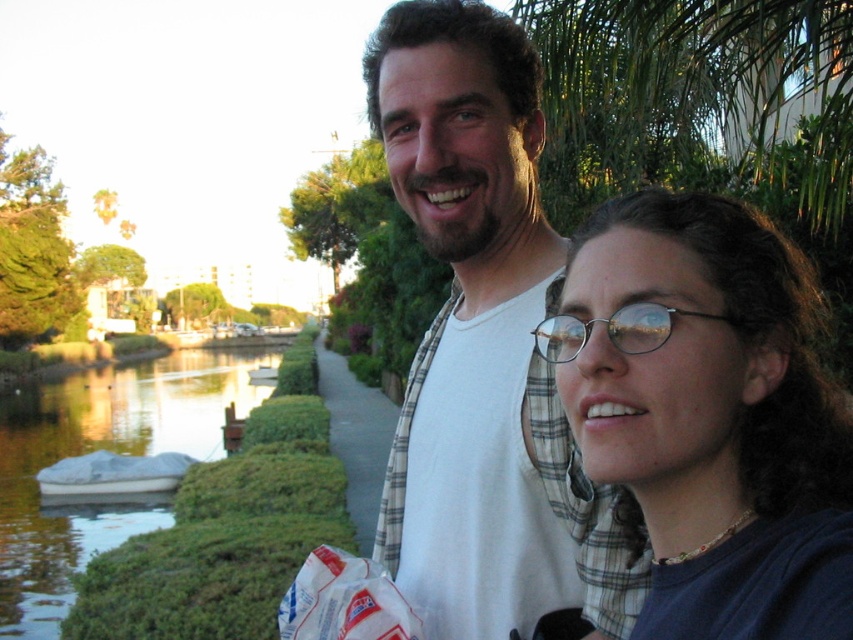
Question: Which of the following is the farthest from the observer?

Choices:
 (A) [x=13, y=541]
 (B) [x=576, y=339]
 (C) [x=445, y=433]
 (D) [x=804, y=545]

Answer: (A)

Question: Among these points, which one is nearest to the camera?

Choices:
 (A) (471, 301)
 (B) (815, 589)
 (C) (50, 436)

Answer: (B)

Question: Considering the relative positions of white cotton shirt at center and clear plastic glasses at center in the image provided, where is white cotton shirt at center located with respect to clear plastic glasses at center?

Choices:
 (A) right
 (B) left

Answer: (B)

Question: In this image, where is white cotton shirt at center located relative to clear plastic glasses at center?

Choices:
 (A) left
 (B) right

Answer: (A)

Question: Estimate the real-world distances between objects in this image. Which object is farther from the matte black glasses at center?

Choices:
 (A) green grassy river at lower left
 (B) clear plastic glasses at center
 (C) white cotton shirt at center

Answer: (A)

Question: Does matte black glasses at center lie behind clear plastic glasses at center?

Choices:
 (A) no
 (B) yes

Answer: (A)